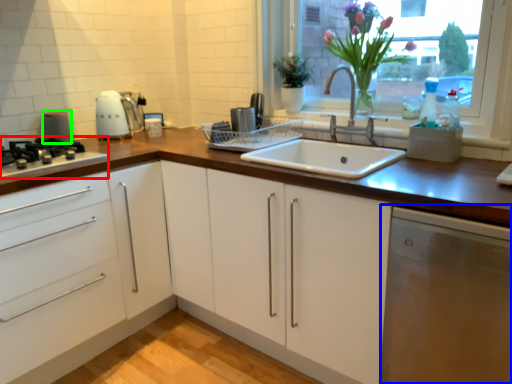
Question: Based on their relative distances, which object is farther from home appliance (highlighted by a red box)? Choose from dish washer (highlighted by a blue box) and appliance (highlighted by a green box).

Choices:
 (A) dish washer
 (B) appliance

Answer: (A)